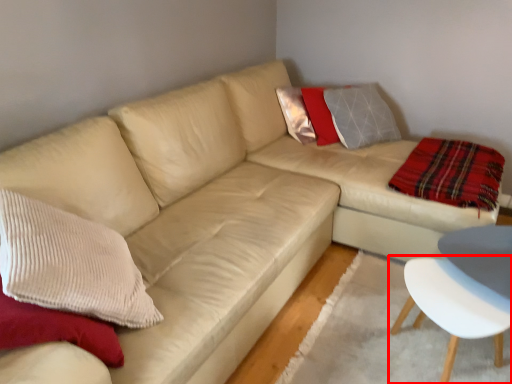
Question: Considering the relative positions of chair (annotated by the red box) and plaid in the image provided, where is chair (annotated by the red box) located with respect to the staircase?

Choices:
 (A) left
 (B) right

Answer: (A)